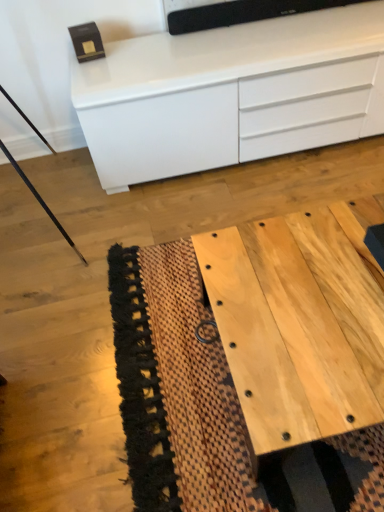
Where is `vacant space that is to the left of natural wood table at lower right`? The width and height of the screenshot is (384, 512). vacant space that is to the left of natural wood table at lower right is located at coordinates (154, 364).